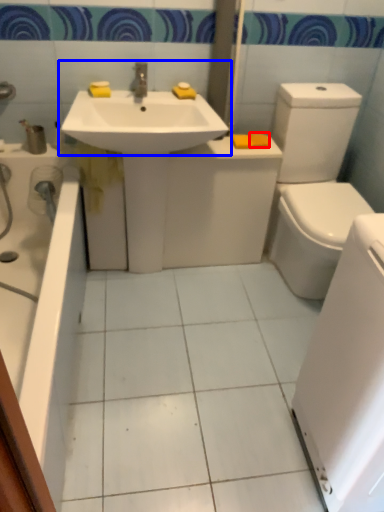
Question: Which of the following is the closest to the observer, soap (highlighted by a red box) or sink (highlighted by a blue box)?

Choices:
 (A) soap
 (B) sink

Answer: (B)